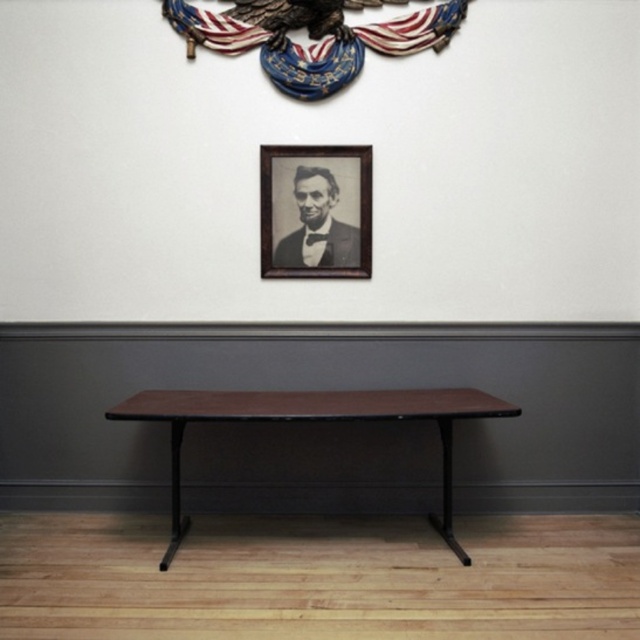
You are standing at the entrance of the room and want to place a new decorative item on the brown laminate table at center. Based on the table location, which direction should you walk to reach it?

The brown laminate table at center is located at point (310, 420), so you should walk towards the center of the room to reach it.

You are arranging furniture in a room and want to place a new lamp on the largest object in the scene. Which object should you choose between the brown laminate table at center and the black wood picture frame at upper center?

The brown laminate table at center has a larger size compared to the black wood picture frame at upper center, so you should place the lamp on the brown laminate table at center.

You are a painter who wants to hang a new artwork that is 1 meter tall. You have two options on the wall where the brown laminate table at center and the black wood picture frame at upper center are located. Considering their heights, which object would you place the artwork above to ensure it doesn

The brown laminate table at center is much taller than the black wood picture frame at upper center. Therefore, placing the artwork above the brown laminate table at center would provide sufficient height for the 1 meter tall artwork.